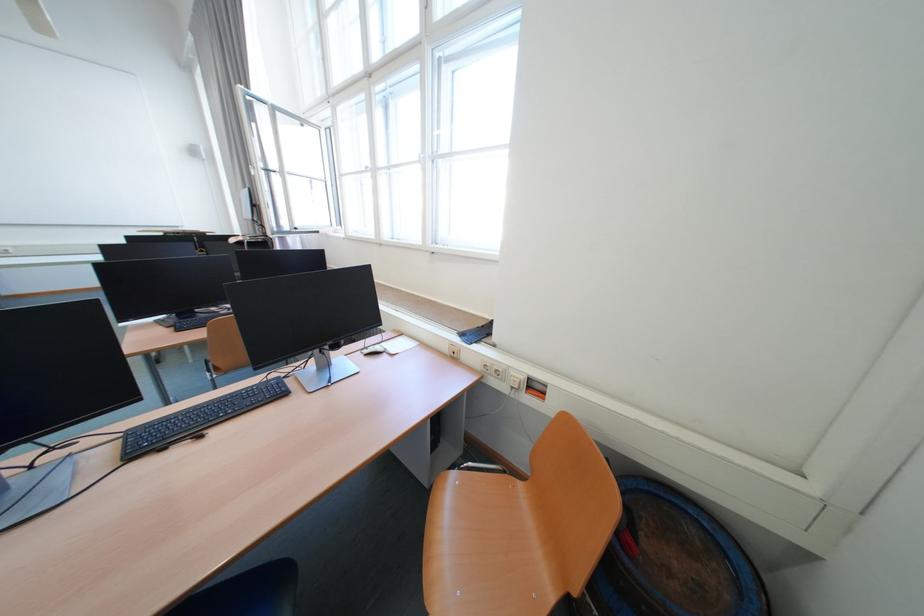
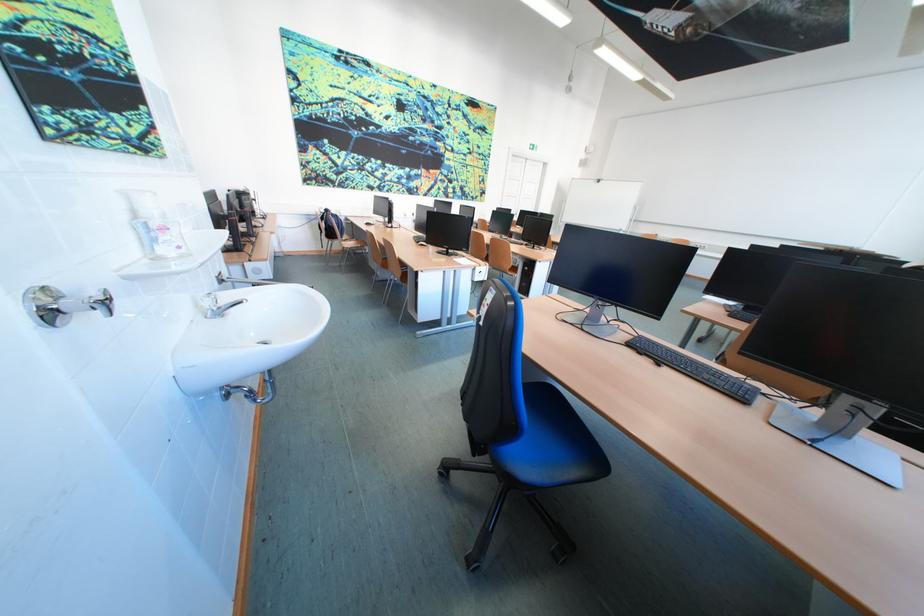
Consider the image. First-person continuous shooting, in which direction is the camera rotating?

The camera's rotation is toward left-down.